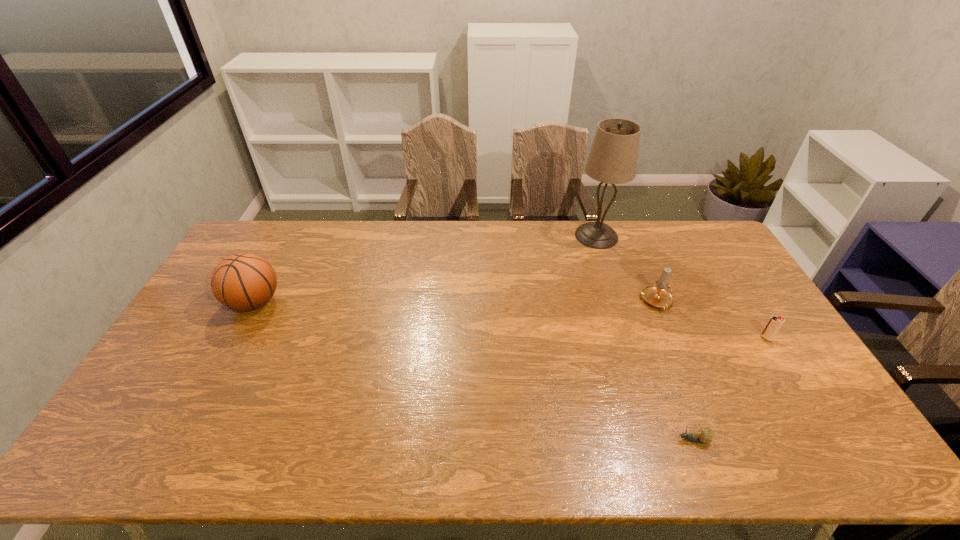
Where is `free space between the basketball and the candle`? free space between the basketball and the candle is located at coordinates (456, 302).

Find the location of a particular element. The image size is (960, 540). vacant area between the basketball and the shortest object is located at coordinates (474, 371).

Where is `free spot between the rightmost object and the nearest object`? free spot between the rightmost object and the nearest object is located at coordinates pos(730,389).

In order to click on free space between the candle and the nearest object in this screenshot , I will do `click(676, 371)`.

Image resolution: width=960 pixels, height=540 pixels. I want to click on free spot between the shortest object and the leftmost object, so click(x=474, y=371).

I want to click on free space between the shortest object and the fourth shortest object, so click(474, 371).

Identify the location of the fourth closest object to the basketball. (774, 324).

Locate which object ranks fourth in proximity to the candle. Please provide its 2D coordinates. Your answer should be formatted as a tuple, i.e. [(x, y)], where the tuple contains the x and y coordinates of a point satisfying the conditions above.

[(243, 282)]